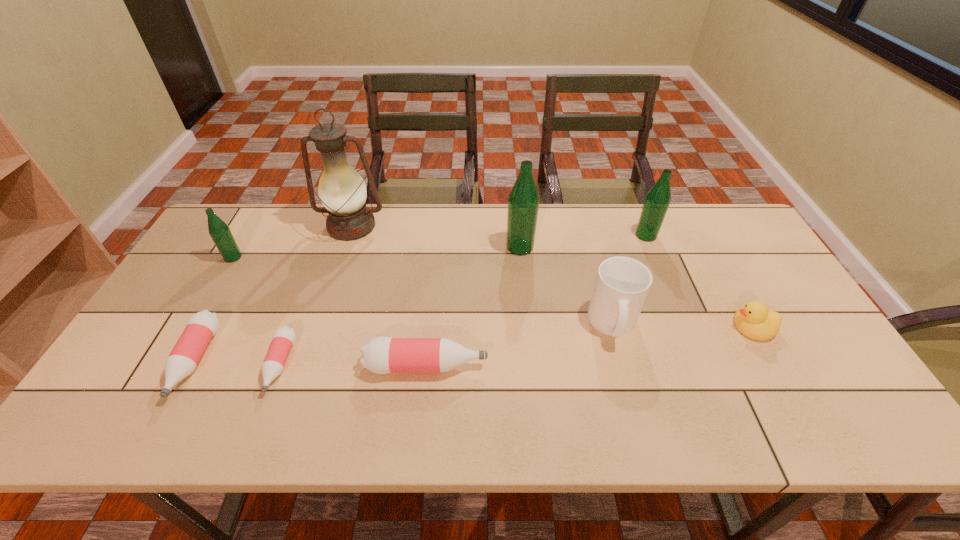
You are a GUI agent. You are given a task and a screenshot of the screen. Output one action in this format:
    pyautogui.click(x=<x>, y=<y>)
    Task: Click on the oil lamp
    The image size is (960, 540).
    Given the screenshot: What is the action you would take?
    pyautogui.click(x=342, y=190)

What are the coordinates of `the second bottle from right to left` in the screenshot? It's located at (523, 202).

Identify the location of the biggest green bottle. This screenshot has height=540, width=960. (523, 202).

At what (x,y) coordinates should I click in order to perform the action: click on the second biggest green bottle. Please return your answer as a coordinate pair (x, y). The image size is (960, 540). Looking at the image, I should click on (658, 198).

Identify the location of the rightmost green bottle. (658, 198).

Locate an element on the screen. the third tallest bottle is located at coordinates (219, 231).

The height and width of the screenshot is (540, 960). What are the coordinates of `the leftmost green bottle` in the screenshot? It's located at (219, 231).

This screenshot has height=540, width=960. Identify the location of the third object from right to left. (622, 283).

This screenshot has width=960, height=540. I want to click on mug, so click(622, 283).

The width and height of the screenshot is (960, 540). Find the location of `the rightmost pink bottle`. the rightmost pink bottle is located at coordinates (381, 355).